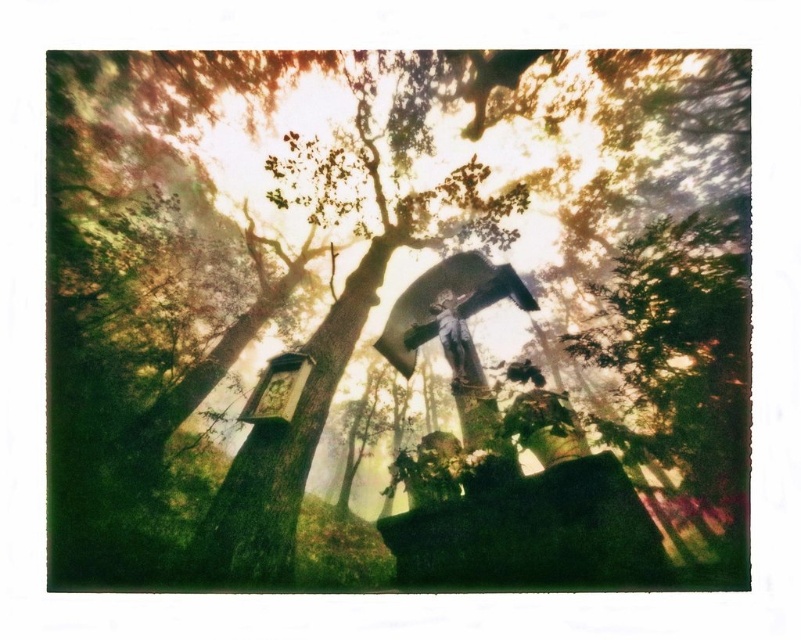
Question: Does green textured tree at center have a smaller size compared to metallic statue at center?

Choices:
 (A) no
 (B) yes

Answer: (A)

Question: In this image, where is green textured tree at center located relative to metallic statue at center?

Choices:
 (A) right
 (B) left

Answer: (B)

Question: Does green textured tree at center have a smaller size compared to metallic statue at center?

Choices:
 (A) no
 (B) yes

Answer: (A)

Question: Which point is farther to the camera?

Choices:
 (A) (544, 138)
 (B) (461, 385)

Answer: (A)